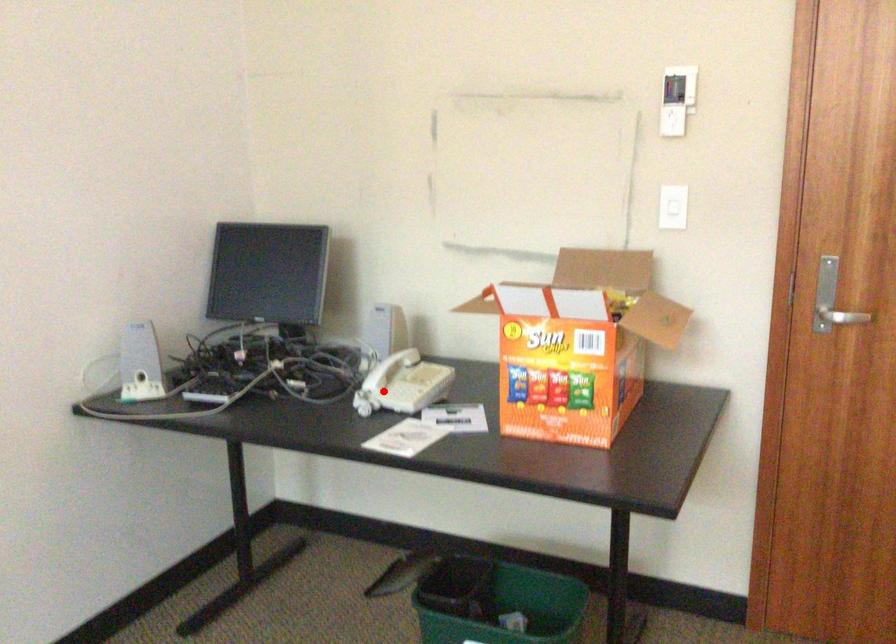
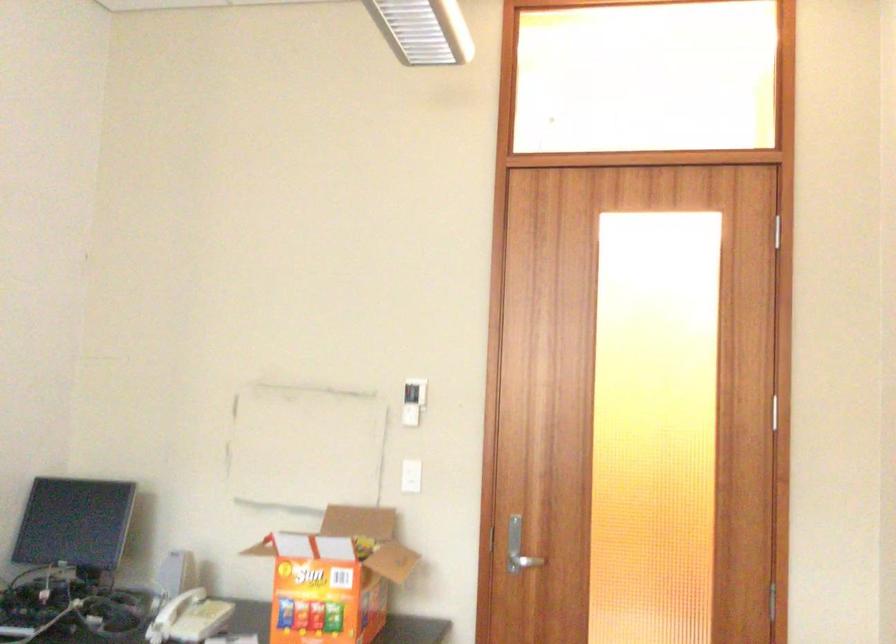
Question: I am providing you with two images of the same scene from different viewpoints. Image1 has a red point marked. In image2, the corresponding 3D location appears at what relative position? Reply with the corresponding letter.

Choices:
 (A) Closer
 (B) Farther

Answer: (B)